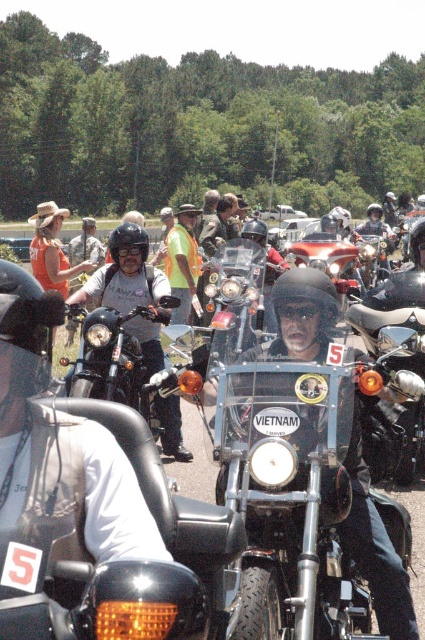
You are a photographer setting up a tripod to capture the motorcycles in the scene. You need to ensure that both the metallic chrome motorcycle at center and the matte black motorcycle at center are fully visible in the frame. Given their height difference, which motorcycle might require you to adjust the tripod angle to avoid cropping its top?

The matte black motorcycle at center is taller than the metallic chrome motorcycle at center. To ensure both are fully visible, you might need to adjust the tripod angle to account for the taller matte black motorcycle at center, ensuring its top isn not cropped while framing both motorcycles.

You are a photographer standing at the edge of the group of motorcyclists. You want to capture a photo that includes both the metallic chrome motorcycle at center and the matte black motorcycle at center. Given that your camera has a maximum focus range of 10 feet, will you be able to get both motorcycles in focus without moving your position?

The metallic chrome motorcycle at center and the matte black motorcycle at center are 11.36 feet apart. Since the distance between them exceeds the camera maximum focus range of 10 feet, you will not be able to capture both motorcycles in focus without moving your position.

You are a photographer positioned at the edge of the rally area. You want to take a photo of both the metallic chrome motorcycle at center and the matte black motorcycle at center. Which motorcycle should you move closer to in order to capture both in the frame without one blocking the other?

The metallic chrome motorcycle at center is in front of the matte black motorcycle at center. To capture both without one blocking the other, you should move closer to the metallic chrome motorcycle at center so that it doesn not obscure the matte black motorcycle at center behind it.